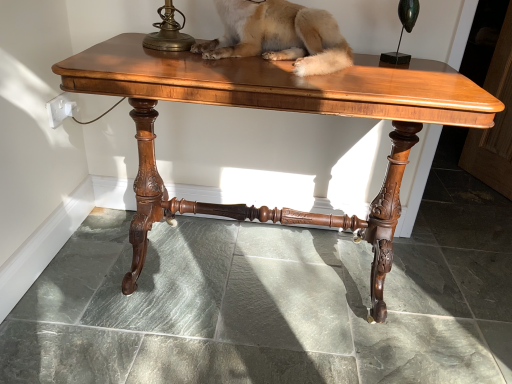
Image resolution: width=512 pixels, height=384 pixels. I want to click on free spot in front of green polished glass candle holder at upper right, so click(x=405, y=74).